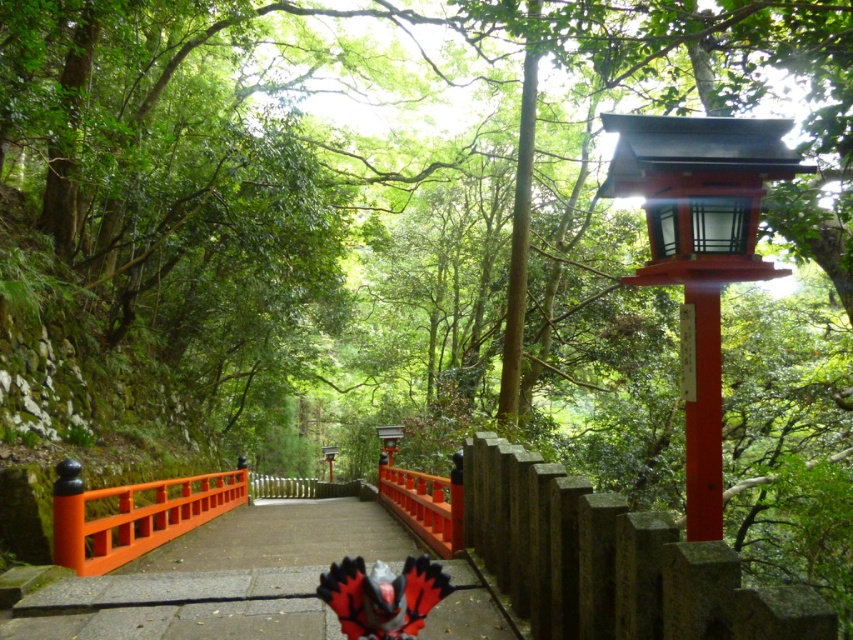
Between point (502, 624) and point (241, 497), which one is positioned in front?

Positioned in front is point (502, 624).

Can you confirm if smooth wooden bridge at center is taller than orange matte/wooden rail at center?

Correct, smooth wooden bridge at center is much taller as orange matte/wooden rail at center.

Is point (477, 612) in front of point (171, 528)?

Yes, it is in front of point (171, 528).

Where is `smooth wooden bridge at center`? The width and height of the screenshot is (853, 640). smooth wooden bridge at center is located at coordinates (219, 579).